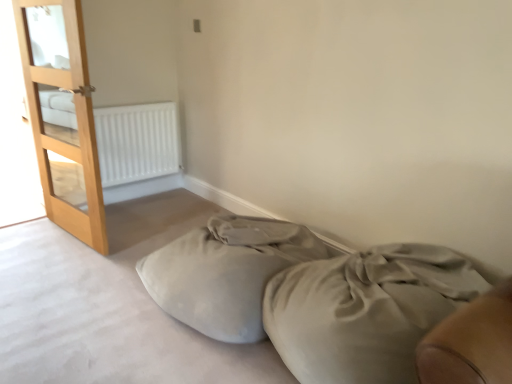
What do you see at coordinates (62, 115) in the screenshot?
I see `light brown wooden door at left` at bounding box center [62, 115].

This screenshot has height=384, width=512. What do you see at coordinates (226, 272) in the screenshot?
I see `soft beige fabric bean bag at lower center` at bounding box center [226, 272].

This screenshot has height=384, width=512. Find the location of `light brown wooden door at left`. light brown wooden door at left is located at coordinates (62, 115).

Is white matte radiator at upper left bigger or smaller than soft beige fabric bean bag at lower center?

Clearly, white matte radiator at upper left is smaller in size than soft beige fabric bean bag at lower center.

Who is taller, white matte radiator at upper left or soft beige fabric bean bag at lower center?

Standing taller between the two is white matte radiator at upper left.

Is white matte radiator at upper left to the left of soft beige fabric bean bag at lower center from the viewer's perspective?

Yes, white matte radiator at upper left is to the left of soft beige fabric bean bag at lower center.

Is white matte radiator at upper left facing towards soft beige fabric bean bag at lower center?

Yes.

In the image, is white matte radiator at upper left positioned in front of or behind light brown wooden door at left?

white matte radiator at upper left is positioned farther from the viewer than light brown wooden door at left.

How different are the orientations of white matte radiator at upper left and light brown wooden door at left in degrees?

white matte radiator at upper left and light brown wooden door at left are facing 82.7 degrees away from each other.

Is white matte radiator at upper left looking in the opposite direction of light brown wooden door at left?

white matte radiator at upper left is not turned away from light brown wooden door at left.

Looking at this image, from the image's perspective, would you say white matte radiator at upper left is positioned over light brown wooden door at left?

No.

Identify the location of bean bag chair below the light brown wooden door at left (from the image's perspective). (226, 272).

Is soft beige fabric bean bag at lower center positioned with its back to light brown wooden door at left?

soft beige fabric bean bag at lower center does not have its back to light brown wooden door at left.

In the scene shown: Is soft beige fabric bean bag at lower center to the left or to the right of light brown wooden door at left in the image?

From the image, it's evident that soft beige fabric bean bag at lower center is to the right of light brown wooden door at left.

Is white matte radiator at upper left closer to camera compared to satin beige bed at lower right?

No, white matte radiator at upper left is further to the viewer.

The image size is (512, 384). I want to click on radiator above the satin beige bed at lower right (from a real-world perspective), so click(x=137, y=142).

Based on the photo, can you confirm if white matte radiator at upper left is shorter than satin beige bed at lower right?

No, white matte radiator at upper left is not shorter than satin beige bed at lower right.

Is point (127, 114) closer or farther from the camera than point (396, 365)?

Clearly, point (127, 114) is more distant from the camera than point (396, 365).

Based on the photo, which of these two, satin beige bed at lower right or light brown wooden door at left, is smaller?

light brown wooden door at left.

Is satin beige bed at lower right positioned beyond the bounds of light brown wooden door at left?

Yes, satin beige bed at lower right is outside of light brown wooden door at left.

Does satin beige bed at lower right appear on the left side of light brown wooden door at left?

In fact, satin beige bed at lower right is to the right of light brown wooden door at left.

How many degrees apart are the facing directions of satin beige bed at lower right and light brown wooden door at left?

7.34 degrees separate the facing orientations of satin beige bed at lower right and light brown wooden door at left.

Based on the photo, are soft beige fabric bean bag at lower center and white matte radiator at upper left located far from each other?

Yes, soft beige fabric bean bag at lower center is far from white matte radiator at upper left.

Considering the positions of point (244, 274) and point (132, 157), is point (244, 274) closer or farther from the camera than point (132, 157)?

Point (244, 274) appears to be closer to the viewer than point (132, 157).

Which object is positioned more to the left, soft beige fabric bean bag at lower center or white matte radiator at upper left?

white matte radiator at upper left is more to the left.

From the image's perspective, does soft beige fabric bean bag at lower center appear higher than white matte radiator at upper left?

No, from the image's perspective, soft beige fabric bean bag at lower center is not above white matte radiator at upper left.

Looking at this image, between light brown wooden door at left and soft beige fabric bean bag at lower center, which one appears on the right side from the viewer's perspective?

soft beige fabric bean bag at lower center is more to the right.

Consider the image. Can you confirm if light brown wooden door at left is bigger than soft beige fabric bean bag at lower center?

Actually, light brown wooden door at left might be smaller than soft beige fabric bean bag at lower center.

Which is closer to the camera, [55,41] or [150,291]?

The point [150,291] is more forward.

Would you say light brown wooden door at left is a long distance from soft beige fabric bean bag at lower center?

That's right, there is a large distance between light brown wooden door at left and soft beige fabric bean bag at lower center.

This screenshot has width=512, height=384. Find the location of `bean bag chair below the white matte radiator at upper left (from a real-world perspective)`. bean bag chair below the white matte radiator at upper left (from a real-world perspective) is located at coordinates (226, 272).

The height and width of the screenshot is (384, 512). In order to click on radiator behind the light brown wooden door at left in this screenshot , I will do `click(137, 142)`.

Considering their positions, is soft beige fabric bean bag at lower center positioned further to white matte radiator at upper left than light brown wooden door at left?

soft beige fabric bean bag at lower center lies further to white matte radiator at upper left than the other object.

In the scene shown: Considering their positions, is light brown wooden door at left positioned further to satin beige bed at lower right than soft beige fabric bean bag at lower center?

light brown wooden door at left.

Which object lies nearer to the anchor point light brown wooden door at left, white matte radiator at upper left or satin beige bed at lower right?

white matte radiator at upper left.

From the image, which object appears to be farther from white matte radiator at upper left, satin beige bed at lower right or soft beige fabric bean bag at lower center?

satin beige bed at lower right lies further to white matte radiator at upper left than the other object.

Considering their positions, is satin beige bed at lower right positioned further to light brown wooden door at left than soft beige fabric bean bag at lower center?

satin beige bed at lower right is positioned further to the anchor light brown wooden door at left.

Which object lies nearer to the anchor point soft beige fabric bean bag at lower center, satin beige bed at lower right or light brown wooden door at left?

satin beige bed at lower right is positioned closer to the anchor soft beige fabric bean bag at lower center.

From the image, which object appears to be farther from satin beige bed at lower right, white matte radiator at upper left or soft beige fabric bean bag at lower center?

white matte radiator at upper left is positioned further to the anchor satin beige bed at lower right.

Looking at the image, which one is located closer to white matte radiator at upper left, light brown wooden door at left or soft beige fabric bean bag at lower center?

light brown wooden door at left is positioned closer to the anchor white matte radiator at upper left.

At what (x,y) coordinates should I click in order to perform the action: click on radiator between light brown wooden door at left and satin beige bed at lower right in the horizontal direction. Please return your answer as a coordinate pair (x, y). The height and width of the screenshot is (384, 512). Looking at the image, I should click on (137, 142).

Identify the location of door between soft beige fabric bean bag at lower center and white matte radiator at upper left in the front-back direction. The height and width of the screenshot is (384, 512). (62, 115).

Identify the location of bean bag chair between satin beige bed at lower right and white matte radiator at upper left from front to back. This screenshot has width=512, height=384. (226, 272).

Locate an element on the screen. bean bag chair located between light brown wooden door at left and satin beige bed at lower right in the left-right direction is located at coordinates (226, 272).